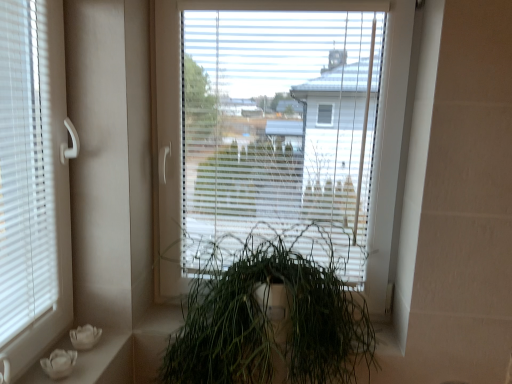
Question: Is green matte plant at center facing towards white matte flower pots at lower left?

Choices:
 (A) yes
 (B) no

Answer: (B)

Question: Is the depth of green matte plant at center greater than that of white matte flower pots at lower left?

Choices:
 (A) no
 (B) yes

Answer: (A)

Question: Would you say white matte flower pots at lower left is part of green matte plant at center's contents?

Choices:
 (A) no
 (B) yes

Answer: (A)

Question: Is green matte plant at center at the right side of white matte flower pots at lower left?

Choices:
 (A) no
 (B) yes

Answer: (B)

Question: From the image's perspective, is green matte plant at center beneath white matte flower pots at lower left?

Choices:
 (A) no
 (B) yes

Answer: (A)

Question: Considering the positions of white matte flower pots at lower left and transparent plastic window at center in the image, is white matte flower pots at lower left taller or shorter than transparent plastic window at center?

Choices:
 (A) tall
 (B) short

Answer: (B)

Question: From the image's perspective, is white matte flower pots at lower left positioned above or below transparent plastic window at center?

Choices:
 (A) above
 (B) below

Answer: (B)

Question: From a real-world perspective, is white matte flower pots at lower left above or below transparent plastic window at center?

Choices:
 (A) above
 (B) below

Answer: (B)

Question: In terms of width, does white matte flower pots at lower left look wider or thinner when compared to transparent plastic window at center?

Choices:
 (A) wide
 (B) thin

Answer: (A)

Question: From a real-world perspective, is transparent plastic window at center positioned above or below green matte plant at center?

Choices:
 (A) above
 (B) below

Answer: (A)

Question: Would you say transparent plastic window at center is to the left or to the right of green matte plant at center in the picture?

Choices:
 (A) right
 (B) left

Answer: (A)

Question: Do you think transparent plastic window at center is within green matte plant at center, or outside of it?

Choices:
 (A) outside
 (B) inside

Answer: (A)

Question: In the image, is transparent plastic window at center positioned in front of or behind green matte plant at center?

Choices:
 (A) front
 (B) behind

Answer: (B)

Question: Is transparent plastic window at center wider or thinner than white matte flower pots at lower left?

Choices:
 (A) thin
 (B) wide

Answer: (A)

Question: Considering the positions of point pyautogui.click(x=339, y=114) and point pyautogui.click(x=132, y=369), is point pyautogui.click(x=339, y=114) closer or farther from the camera than point pyautogui.click(x=132, y=369)?

Choices:
 (A) closer
 (B) farther

Answer: (B)